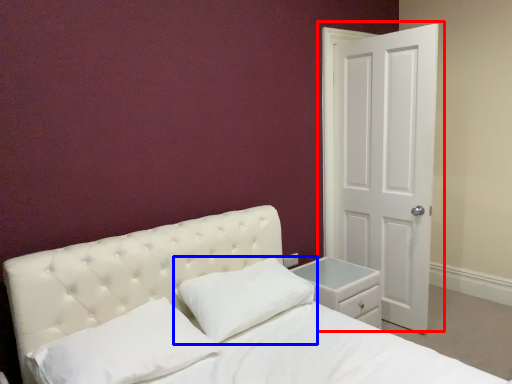
Question: Among these objects, which one is farthest to the camera, door (highlighted by a red box) or pillow (highlighted by a blue box)?

Choices:
 (A) door
 (B) pillow

Answer: (A)